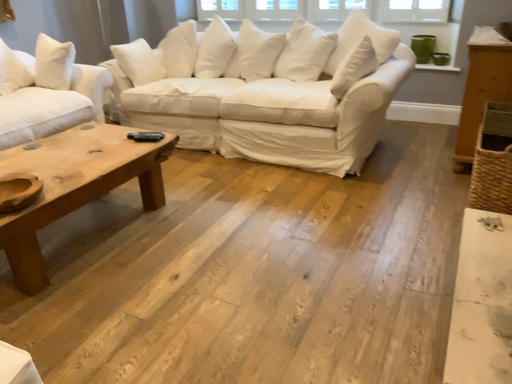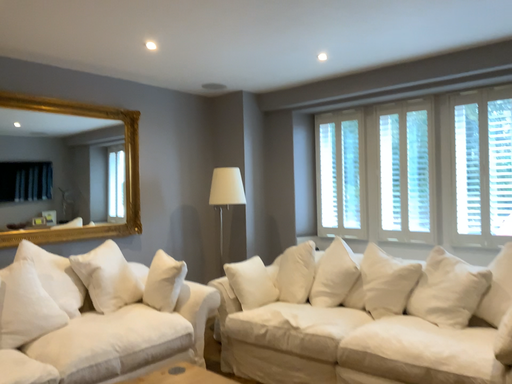
Question: Which way did the camera rotate in the video?

Choices:
 (A) rotated left
 (B) rotated right

Answer: (A)